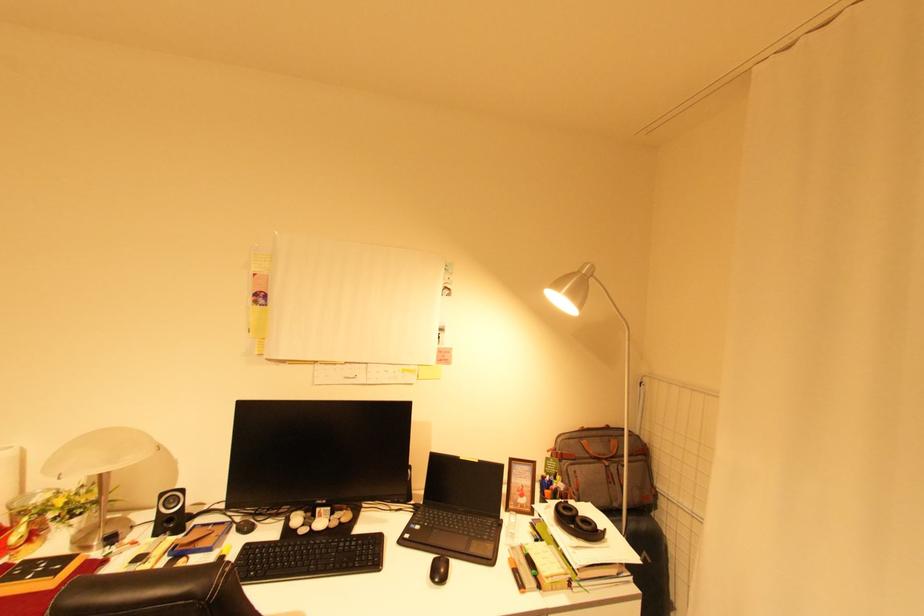
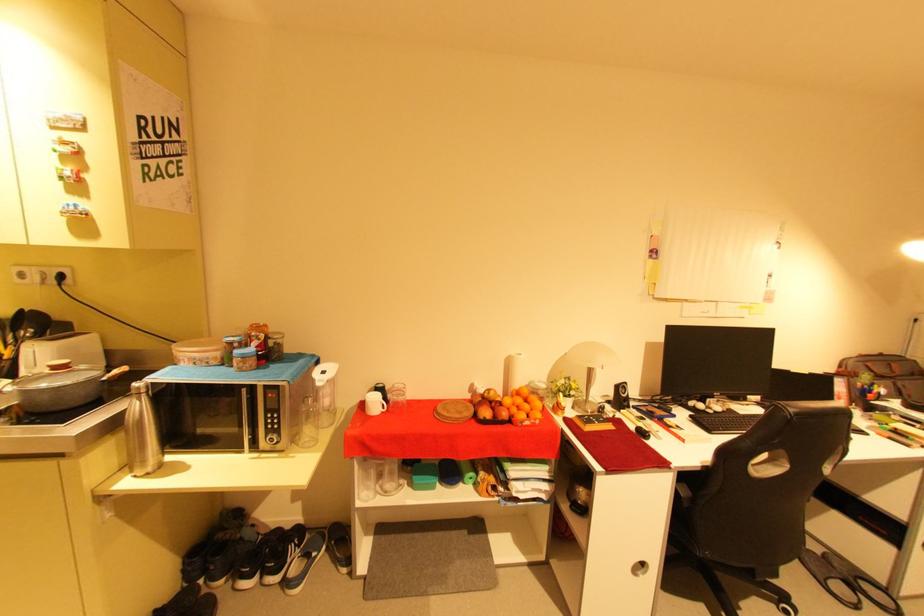
Find the pixel in the second image that matches point 334,528 in the first image.

(730, 411)